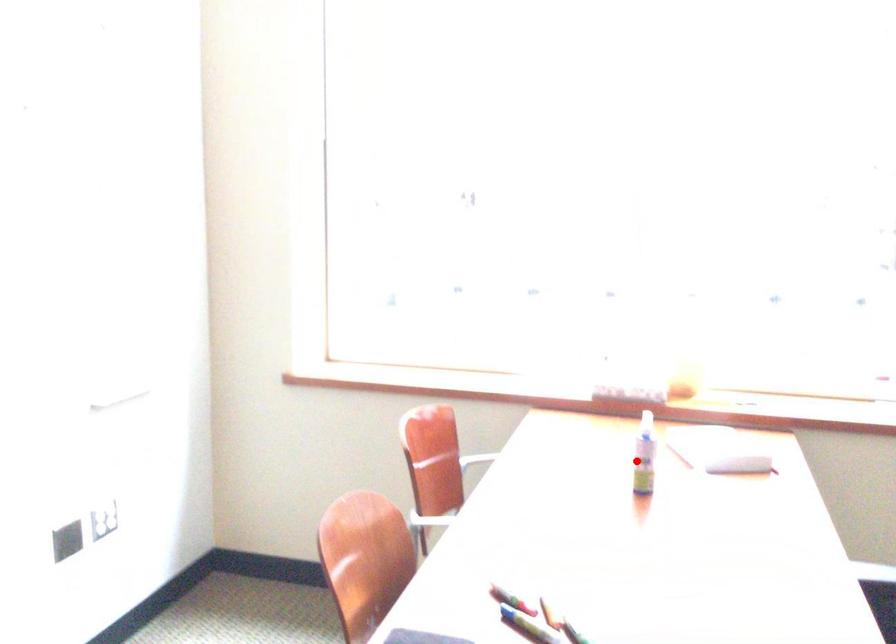
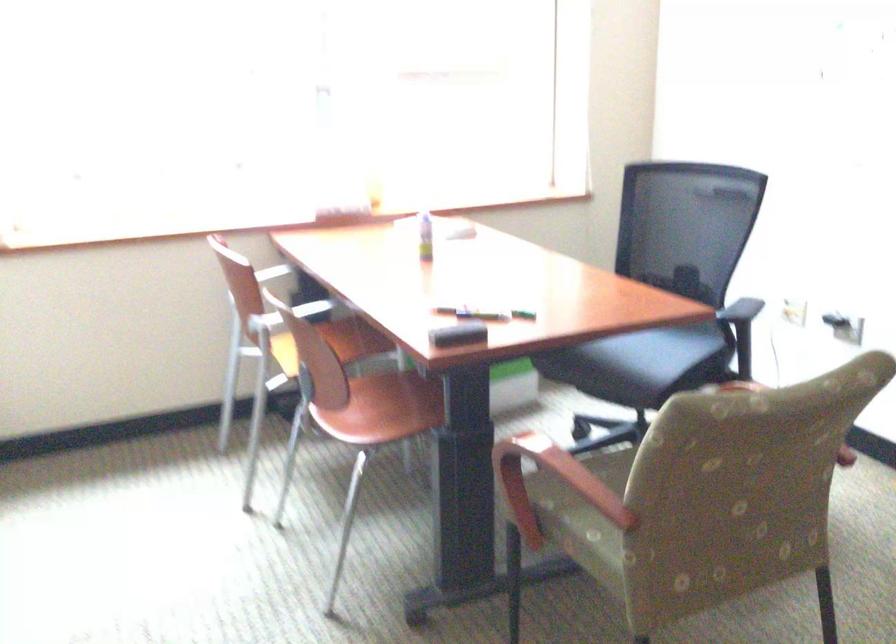
In the second image, find the point that corresponds to the highlighted location in the first image.

(425, 236)